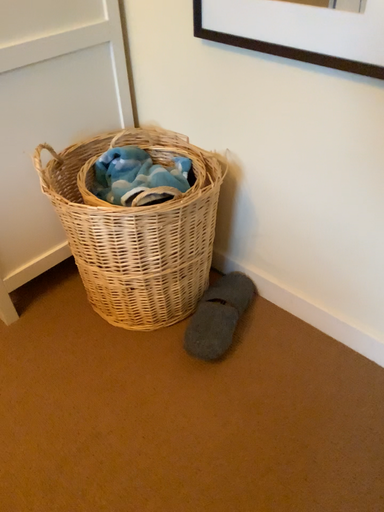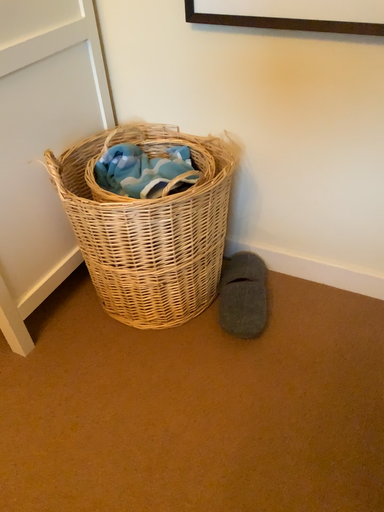
Question: Which way did the camera rotate in the video?

Choices:
 (A) rotated right
 (B) rotated left

Answer: (A)